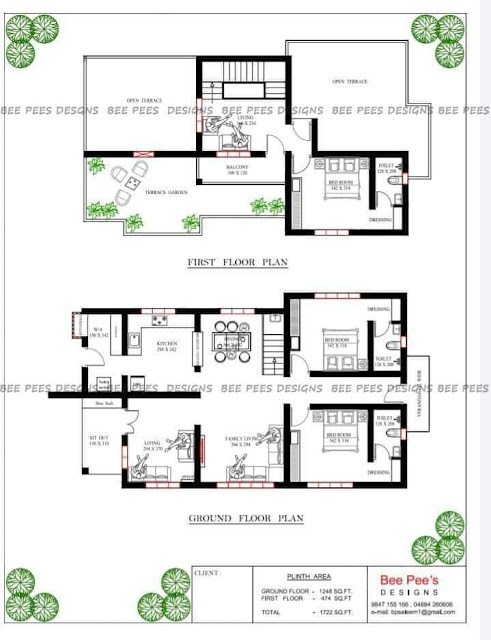
Find the location of a particular element. This screenshot has width=491, height=640. stove is located at coordinates (160, 324).